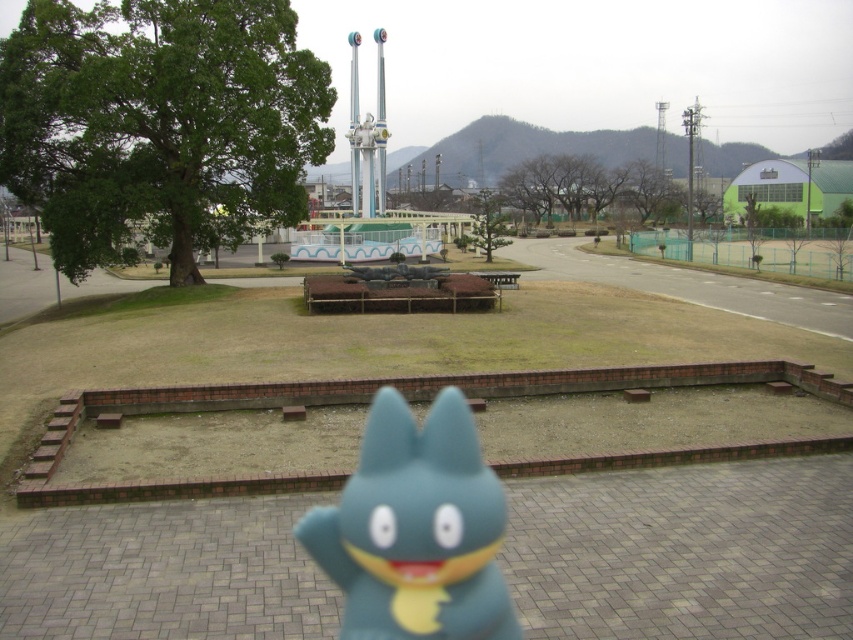
You are standing in the park and see two points marked in the image. Which point, point [416,547] or point [517,275], is closer to you?

Point [416,547] is closer to the viewer than point [517,275].

You are standing in the park and want to reach the point marked at coordinates (386, 394). The paved area in front of you is 10 meters wide. Can you walk straight ahead to reach the point without crossing the grass?

The distance between you and the point is 10.92 meters. The paved area is only 10 meters wide, so you would have to walk onto the grass to reach the point.

You are a child who wants to play with the blue rubber toy at center and the wooden park bench at center. Which object is bigger?

The wooden park bench at center is bigger than the blue rubber toy at center.